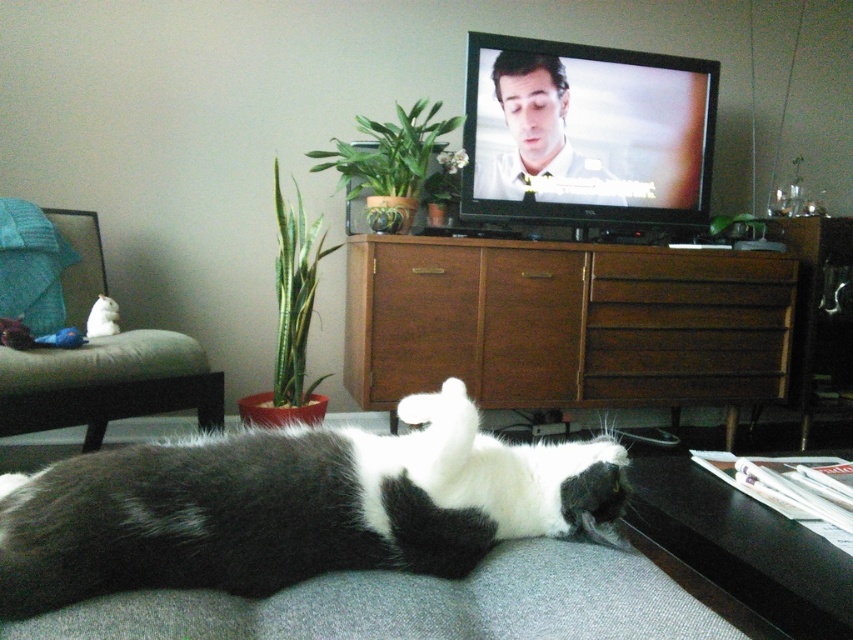
Question: Which point appears farthest from the camera in this image?

Choices:
 (A) (486, 330)
 (B) (367, 506)

Answer: (A)

Question: Is black and white fur cat at lower center behind brown wood dresser at center?

Choices:
 (A) yes
 (B) no

Answer: (B)

Question: Can you confirm if black and white fur cat at lower center is positioned above brown wood dresser at center?

Choices:
 (A) yes
 (B) no

Answer: (B)

Question: Which point is closer to the camera taking this photo?

Choices:
 (A) (310, 480)
 (B) (468, 320)

Answer: (A)

Question: Does black and white fur cat at lower center lie in front of brown wood dresser at center?

Choices:
 (A) yes
 (B) no

Answer: (A)